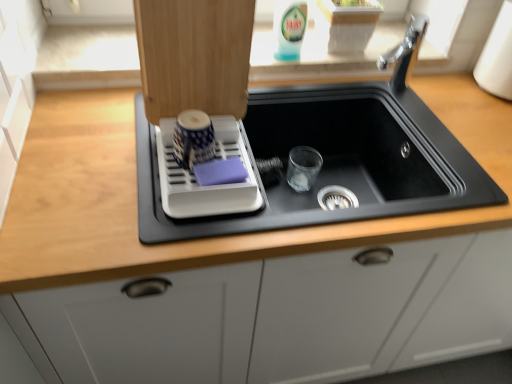
Image resolution: width=512 pixels, height=384 pixels. I want to click on free space in front of white plastic dish rack at upper left, so click(143, 228).